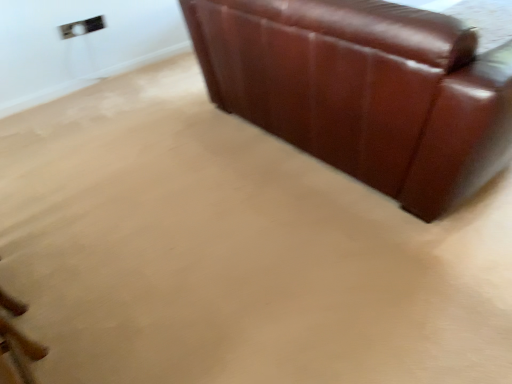
This screenshot has width=512, height=384. Describe the element at coordinates (364, 90) in the screenshot. I see `shiny brown leather couch at upper right` at that location.

In order to face shiny brown leather couch at upper right, should I rotate leftwards or rightwards?

To align with it, rotate right about 12.546°.

Where is `shiny brown leather couch at upper right`? Image resolution: width=512 pixels, height=384 pixels. shiny brown leather couch at upper right is located at coordinates (364, 90).

Identify the location of shiny brown leather couch at upper right. (364, 90).